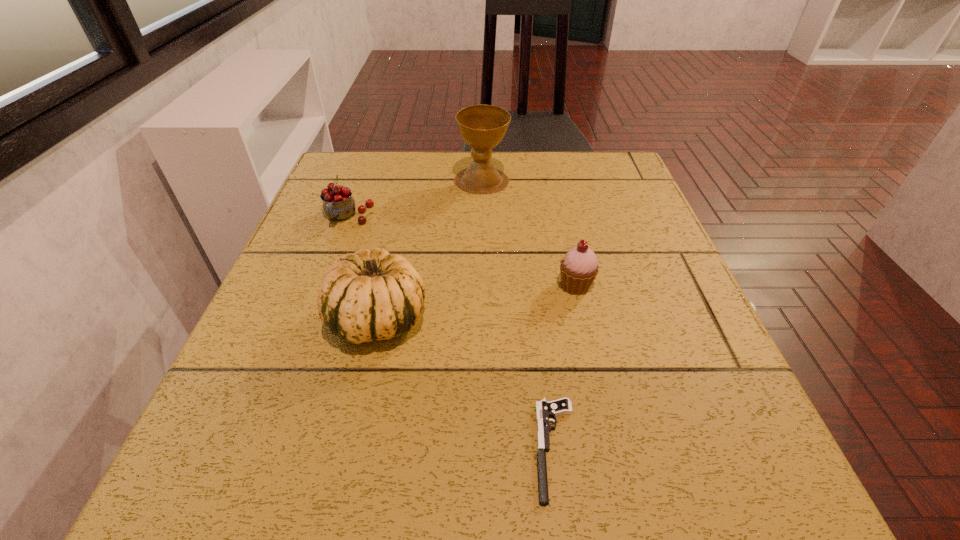
This screenshot has width=960, height=540. I want to click on vacant region that satisfies the following two spatial constraints: 1. on the handle side of the cherry; 2. on the left side of the gourd, so click(309, 319).

Locate an element on the screen. Image resolution: width=960 pixels, height=540 pixels. free region that satisfies the following two spatial constraints: 1. on the handle side of the cherry; 2. on the right side of the rightmost object is located at coordinates (322, 286).

You are a GUI agent. You are given a task and a screenshot of the screen. Output one action in this format:
    pyautogui.click(x=<x>, y=<y>)
    Task: Click on the blank space that satisfies the following two spatial constraints: 1. on the front side of the cupcake; 2. on the front-facing side of the nearest object
    Image resolution: width=960 pixels, height=540 pixels.
    Given the screenshot: What is the action you would take?
    pyautogui.click(x=612, y=449)